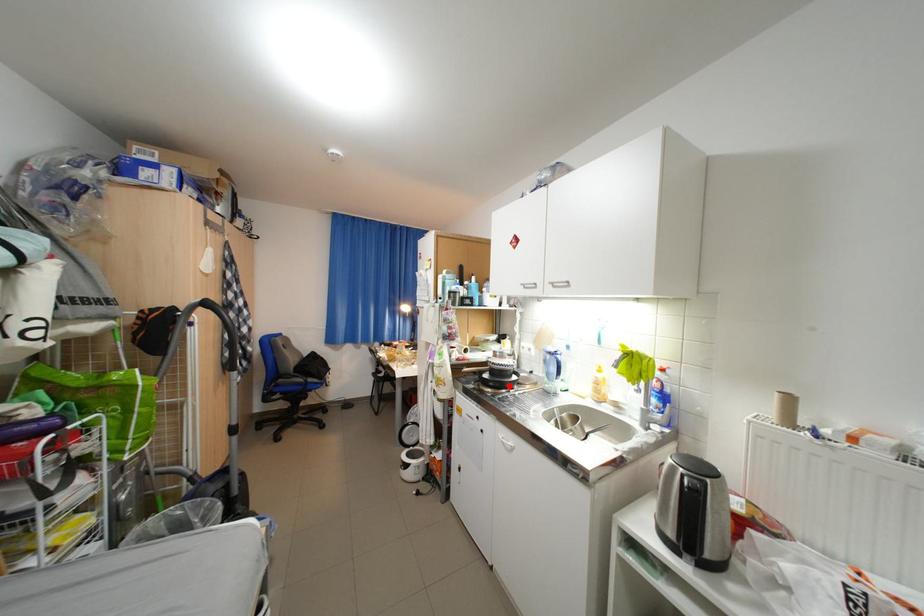
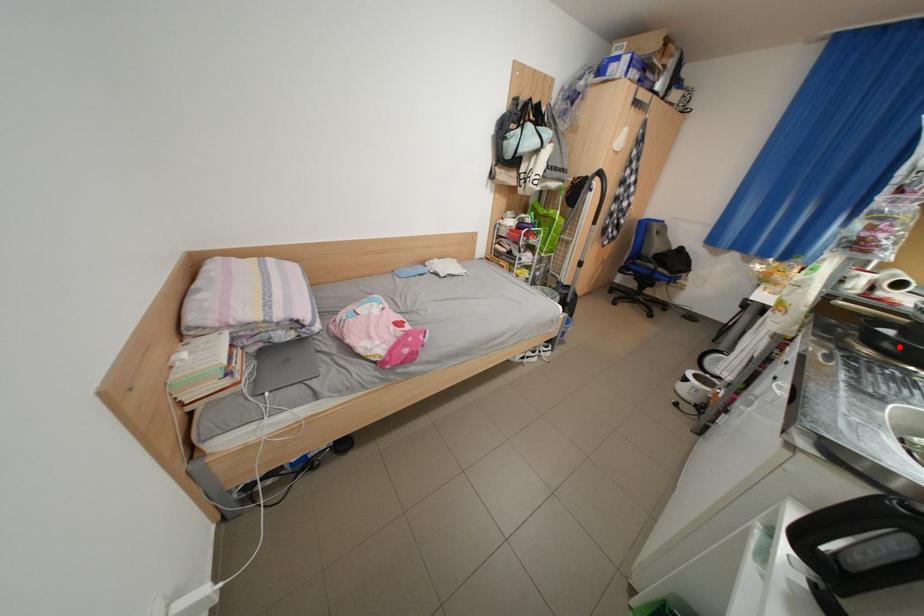
I am providing you with two images of the same scene from different viewpoints. A red point is marked on the first image and another point is marked on the second image. Is the marked point in image1 the same physical position as the marked point in image2?

Yes